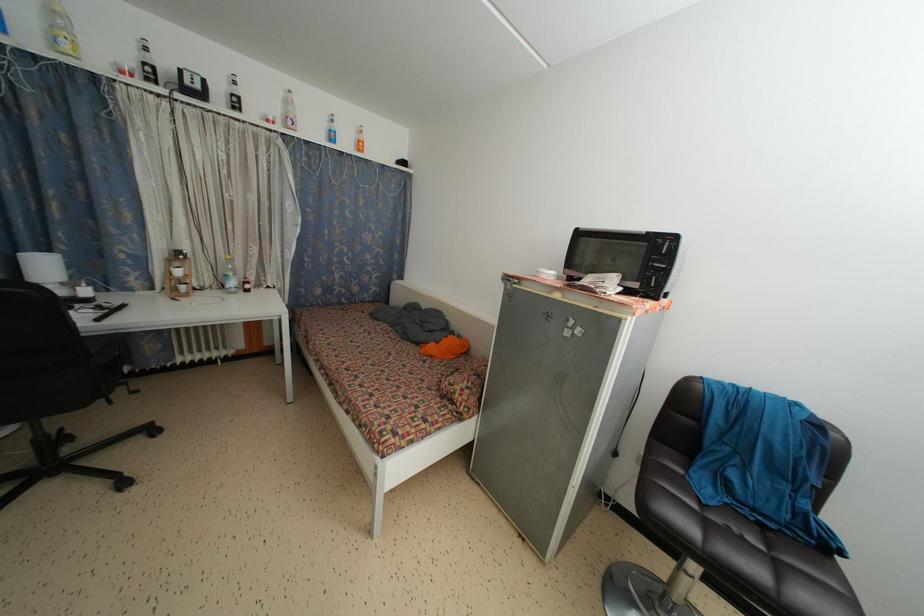
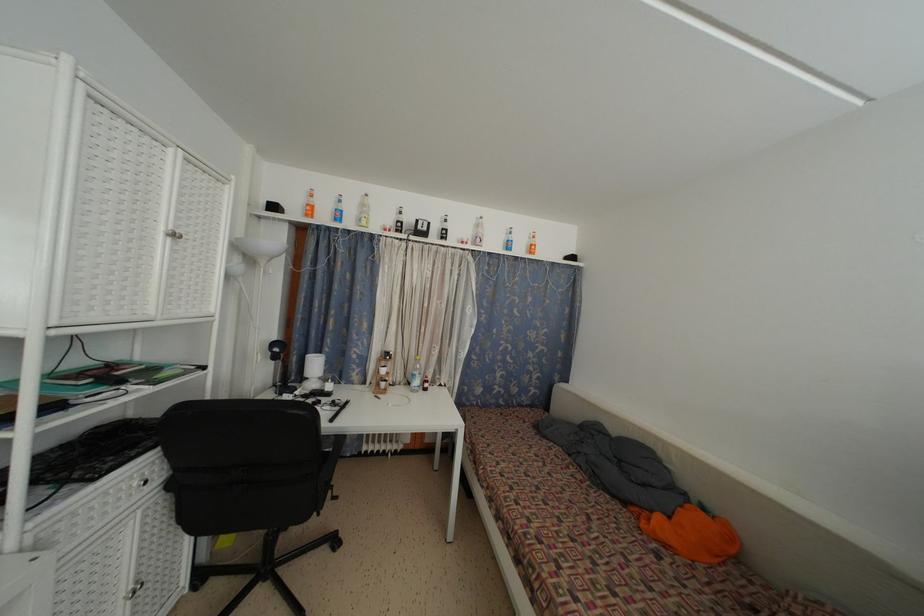
Where in the second image is the point corresponding to point 52,254 from the first image?

(323, 357)